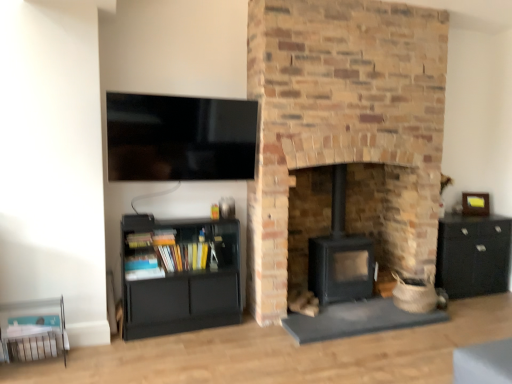
What do you see at coordinates (473, 255) in the screenshot? Image resolution: width=512 pixels, height=384 pixels. I see `black matte cabinet at right` at bounding box center [473, 255].

What do you see at coordinates (475, 204) in the screenshot?
I see `wooden picture frame at right` at bounding box center [475, 204].

Locate an element on the screen. The height and width of the screenshot is (384, 512). wooden picture frame at right is located at coordinates (475, 204).

The height and width of the screenshot is (384, 512). Describe the element at coordinates (179, 275) in the screenshot. I see `matte black bookshelf at lower left` at that location.

From the picture: Measure the distance between point (267, 196) and camera.

Point (267, 196) is 3.36 meters from camera.

This screenshot has height=384, width=512. What are the coordinates of `black matte cabinet at right` in the screenshot? It's located at click(x=473, y=255).

Is point (364, 268) more distant than point (294, 124)?

Yes, point (364, 268) is behind point (294, 124).

What are the coordinates of `fireplace that appears on the right of black matte wood burning stove at center` in the screenshot? It's located at (344, 127).

Is black matte wood burning stove at center smaller than brick fireplace at center?

Yes, black matte wood burning stove at center is smaller than brick fireplace at center.

From a real-world perspective, between matte black bookshelf at lower left and black matte cabinet at right, who is vertically lower?

In real-world perspective, black matte cabinet at right is lower.

Where is `cabinetry located behind the matte black bookshelf at lower left`? The image size is (512, 384). cabinetry located behind the matte black bookshelf at lower left is located at coordinates (473, 255).

Is matte black bookshelf at lower left at the left side of black matte cabinet at right?

Yes.

From a real-world perspective, relative to wooden picture frame at right, is matte black bookshelf at lower left vertically above or below?

In terms of real-world spatial position, matte black bookshelf at lower left is below wooden picture frame at right.

Is matte black bookshelf at lower left placed right next to wooden picture frame at right?

matte black bookshelf at lower left is not next to wooden picture frame at right, and they're not touching.

Can you tell me how much matte black bookshelf at lower left and wooden picture frame at right differ in facing direction?

26.6 degrees separate the facing orientations of matte black bookshelf at lower left and wooden picture frame at right.

Can you confirm if wooden picture frame at right is positioned to the left of brick fireplace at center?

No, wooden picture frame at right is not to the left of brick fireplace at center.

Measure the distance from wooden picture frame at right to brick fireplace at center.

A distance of 5.33 feet exists between wooden picture frame at right and brick fireplace at center.

Is there a large distance between wooden picture frame at right and brick fireplace at center?

wooden picture frame at right is far away from brick fireplace at center.

Considering their positions, is wooden picture frame at right located in front of or behind brick fireplace at center?

In the image, wooden picture frame at right appears behind brick fireplace at center.

How much distance is there between flat screen tv at upper left and brick fireplace at center?

flat screen tv at upper left is 82.11 centimeters from brick fireplace at center.

How different are the orientations of flat screen tv at upper left and brick fireplace at center in degrees?

There is a 0.904-degree angle between the facing directions of flat screen tv at upper left and brick fireplace at center.

In terms of width, does flat screen tv at upper left look wider or thinner when compared to brick fireplace at center?

Clearly, flat screen tv at upper left has less width compared to brick fireplace at center.

Considering the positions of points (134, 107) and (413, 33), is point (134, 107) farther from camera compared to point (413, 33)?

No, (134, 107) is in front of (413, 33).

From a real-world perspective, is wooden picture frame at right above or below matte black bookshelf at lower left?

In terms of real-world spatial position, wooden picture frame at right is above matte black bookshelf at lower left.

Between wooden picture frame at right and matte black bookshelf at lower left, which one appears on the right side from the viewer's perspective?

wooden picture frame at right.

Is wooden picture frame at right bigger than matte black bookshelf at lower left?

Actually, wooden picture frame at right might be smaller than matte black bookshelf at lower left.

Is matte black bookshelf at lower left completely or partially inside wooden picture frame at right?

Definitely not — matte black bookshelf at lower left is not inside wooden picture frame at right.

From the image's perspective, is black matte cabinet at right above black matte wood burning stove at center?

No, from the image's perspective, black matte cabinet at right is not over black matte wood burning stove at center.

Which object is positioned more to the right, black matte cabinet at right or black matte wood burning stove at center?

From the viewer's perspective, black matte cabinet at right appears more on the right side.

From a real-world perspective, which is physically below, black matte cabinet at right or black matte wood burning stove at center?

black matte cabinet at right.

Locate an element on the screen. This screenshot has height=384, width=512. fireplace on the right of black matte wood burning stove at center is located at coordinates (344, 127).

In order to click on cabinetry lying behind the matte black bookshelf at lower left in this screenshot , I will do `click(473, 255)`.

Based on their spatial positions, is black matte wood burning stove at center or black matte cabinet at right closer to brick fireplace at center?

black matte wood burning stove at center is closer to brick fireplace at center.

Considering their positions, is brick fireplace at center positioned further to black matte cabinet at right than matte black bookshelf at lower left?

matte black bookshelf at lower left is positioned further to the anchor black matte cabinet at right.

Which object lies further to the anchor point brick fireplace at center, black matte wood burning stove at center or matte black bookshelf at lower left?

Based on the image, matte black bookshelf at lower left appears to be further to brick fireplace at center.

Which object lies further to the anchor point black matte wood burning stove at center, matte black bookshelf at lower left or black matte cabinet at right?

Based on the image, matte black bookshelf at lower left appears to be further to black matte wood burning stove at center.

Looking at the image, which one is located closer to black matte cabinet at right, flat screen tv at upper left or wooden picture frame at right?

Based on the image, wooden picture frame at right appears to be nearer to black matte cabinet at right.

Estimate the real-world distances between objects in this image. Which object is closer to matte black bookshelf at lower left, black matte cabinet at right or brick fireplace at center?

Based on the image, brick fireplace at center appears to be nearer to matte black bookshelf at lower left.

Estimate the real-world distances between objects in this image. Which object is closer to matte black bookshelf at lower left, flat screen tv at upper left or black matte wood burning stove at center?

Based on the image, flat screen tv at upper left appears to be nearer to matte black bookshelf at lower left.

From the picture: Considering their positions, is black matte wood burning stove at center positioned further to wooden picture frame at right than matte black bookshelf at lower left?

The object further to wooden picture frame at right is matte black bookshelf at lower left.

This screenshot has width=512, height=384. What are the coordinates of `television between matte black bookshelf at lower left and black matte cabinet at right` in the screenshot? It's located at (180, 138).

Locate an element on the screen. cabinetry located between black matte wood burning stove at center and wooden picture frame at right in the left-right direction is located at coordinates (473, 255).

Locate an element on the screen. This screenshot has width=512, height=384. wood burning stove situated between flat screen tv at upper left and black matte cabinet at right from left to right is located at coordinates (341, 254).

Where is `cabinetry located between brick fireplace at center and wooden picture frame at right in the depth direction`? cabinetry located between brick fireplace at center and wooden picture frame at right in the depth direction is located at coordinates (473, 255).